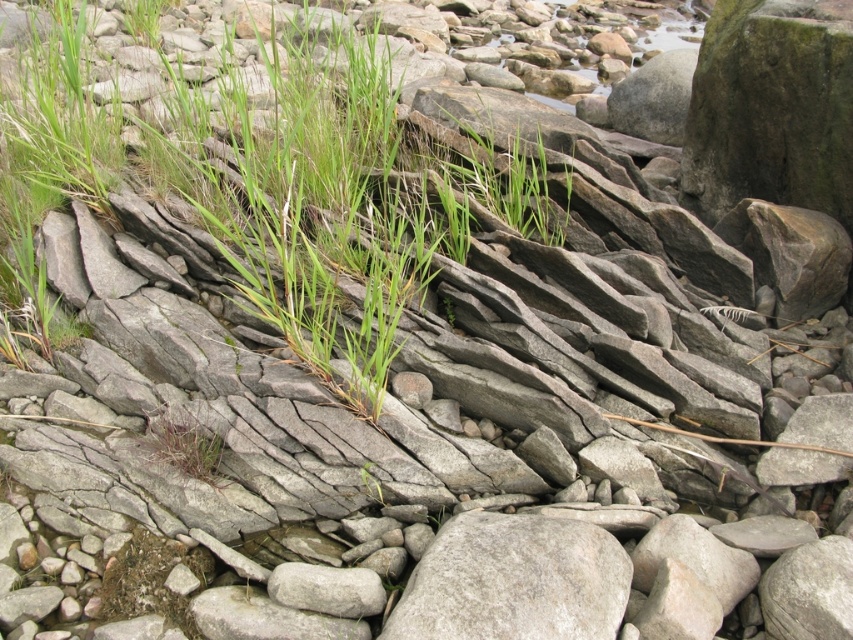
Does gray rough rock at center have a smaller size compared to green grass at center?

No, gray rough rock at center is not smaller than green grass at center.

Who is more forward, (544, 589) or (190, 452)?

Point (544, 589) is more forward.

Is point (465, 611) more distant than point (219, 460)?

That is False.

Where is `gray rough rock at center`? The image size is (853, 640). gray rough rock at center is located at coordinates (514, 580).